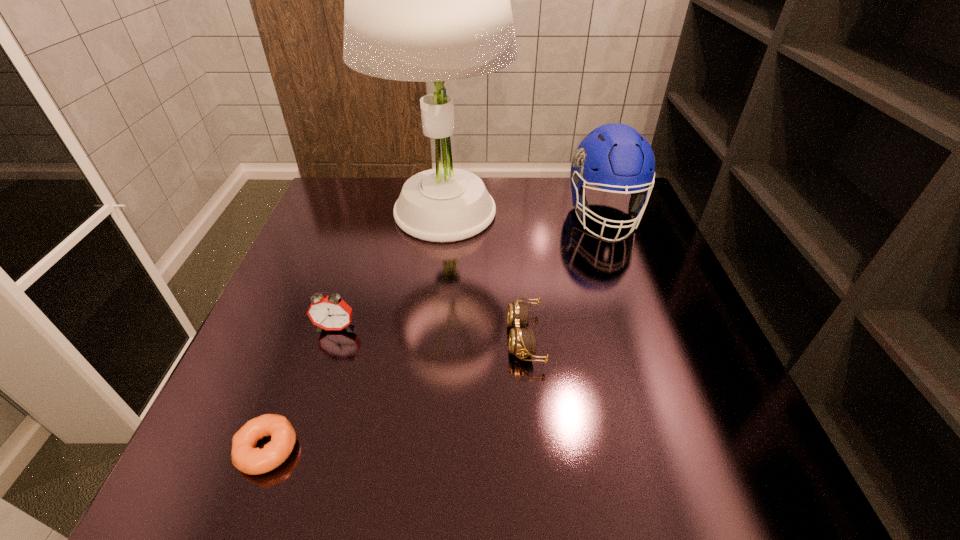
At what (x,y) coordinates should I click in order to perform the action: click on object that is the third closest to the tallest object. Please return your answer as a coordinate pair (x, y). Looking at the image, I should click on (330, 312).

Where is `object that stands as the fourth closest to the goggles`? object that stands as the fourth closest to the goggles is located at coordinates (245, 457).